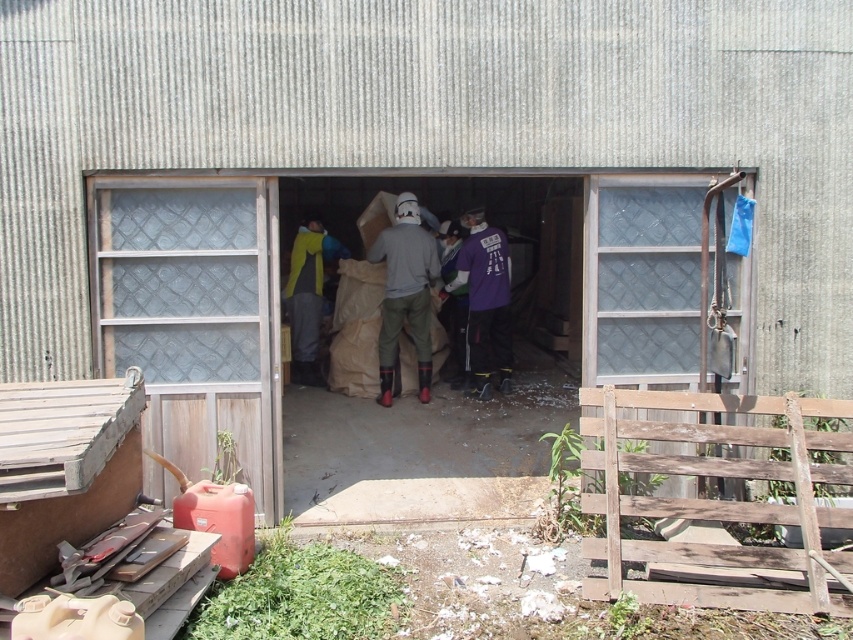
Question: Which of the following is the farthest from the observer?

Choices:
 (A) (294, 348)
 (B) (466, 346)

Answer: (A)

Question: Which point is farther from the camera taking this photo?

Choices:
 (A) (374, 257)
 (B) (468, 209)

Answer: (B)

Question: Can you confirm if purple matte shirt at center is smaller than purple fabric at center?

Choices:
 (A) no
 (B) yes

Answer: (A)

Question: Is matte gray sweatshirt at center to the left of purple fabric at center from the viewer's perspective?

Choices:
 (A) yes
 (B) no

Answer: (A)

Question: Is yellow fabric jacket at center above purple fabric at center?

Choices:
 (A) no
 (B) yes

Answer: (B)

Question: Which object is farther from the camera taking this photo?

Choices:
 (A) purple matte shirt at center
 (B) clear glass door at left
 (C) purple fabric at center
 (D) yellow fabric jacket at center

Answer: (D)